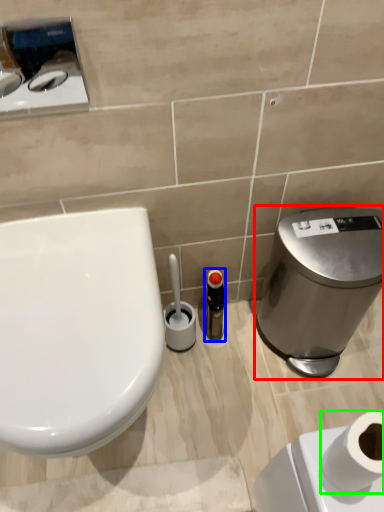
Question: Which object is the closest to the water cooler (highlighted by a red box)? Choose among these: toiletry (highlighted by a blue box) or toilet paper (highlighted by a green box).

Choices:
 (A) toiletry
 (B) toilet paper

Answer: (A)